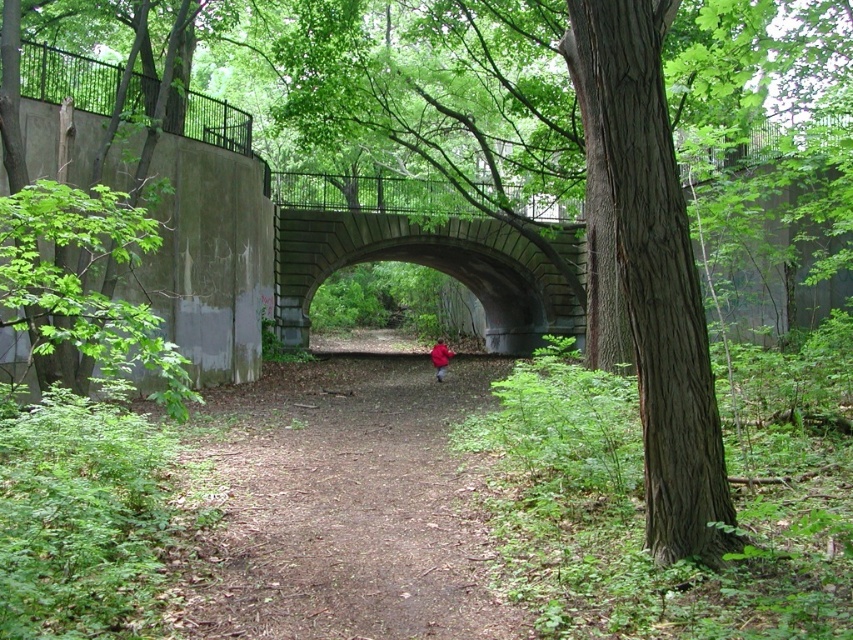
You are a hiker who wants to know which object is shorter between the brown dirt path at center and the green textured bark tree at right. Can you tell me?

The brown dirt path at center has a lesser height compared to the green textured bark tree at right, so the brown dirt path at center is shorter.

Looking at this image, you are a hiker who wants to cross the stone bridge. You have a red matte jacket at center and need to place it on the brown dirt path at center. Based on their sizes, will the jacket fit entirely on the dirt path?

The brown dirt path at center has a larger size compared to red matte jacket at center, so yes, the jacket will fit entirely on the dirt path.